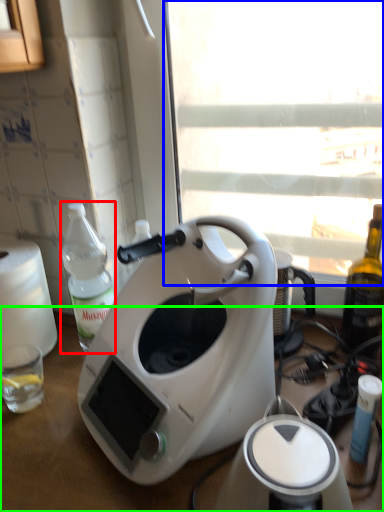
Question: Considering the real-world distances, which object is farthest from bottle (highlighted by a red box)? window screen (highlighted by a blue box) or table (highlighted by a green box)?

Choices:
 (A) window screen
 (B) table

Answer: (A)